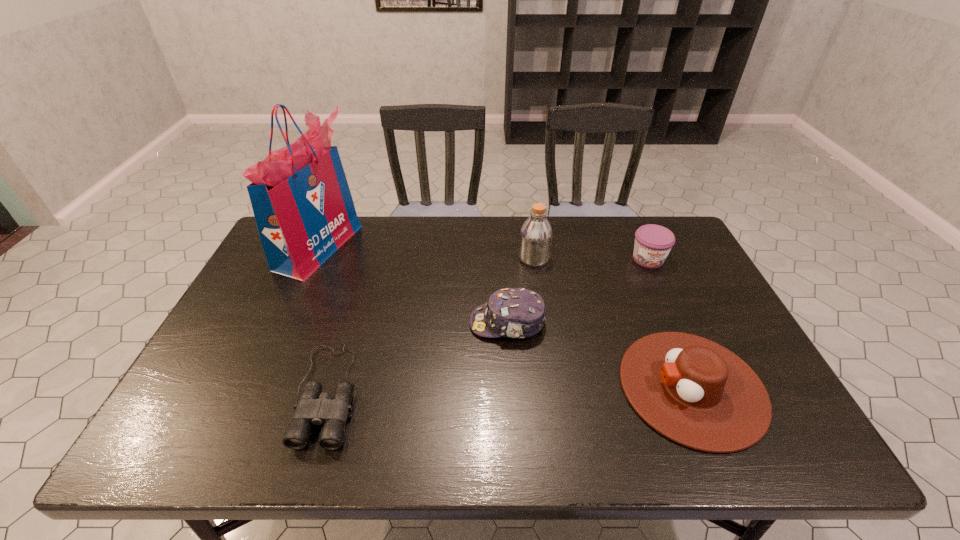
The height and width of the screenshot is (540, 960). Identify the location of grocery bag. (304, 211).

Find the location of a particular element. The width and height of the screenshot is (960, 540). bottle is located at coordinates (536, 235).

I want to click on jam, so click(x=653, y=243).

At what (x,y) coordinates should I click in order to perform the action: click on headwear. Please return your answer as a coordinate pair (x, y). The width and height of the screenshot is (960, 540). Looking at the image, I should click on (519, 313).

Where is `cowboy hat`? The width and height of the screenshot is (960, 540). cowboy hat is located at coordinates (697, 393).

Where is `binoculars`? The height and width of the screenshot is (540, 960). binoculars is located at coordinates point(314,407).

What are the coordinates of `vacant space located 0.190m on the front-facing side of the grocery bag` in the screenshot? It's located at (413, 247).

The image size is (960, 540). I want to click on vacant space located on the front of the bottle, so click(540, 302).

Find the location of a particular element. The image size is (960, 540). free spot located on the front label of the jam is located at coordinates (675, 318).

This screenshot has height=540, width=960. What are the coordinates of `free space located 0.190m on the front-facing side of the headwear` in the screenshot? It's located at (399, 323).